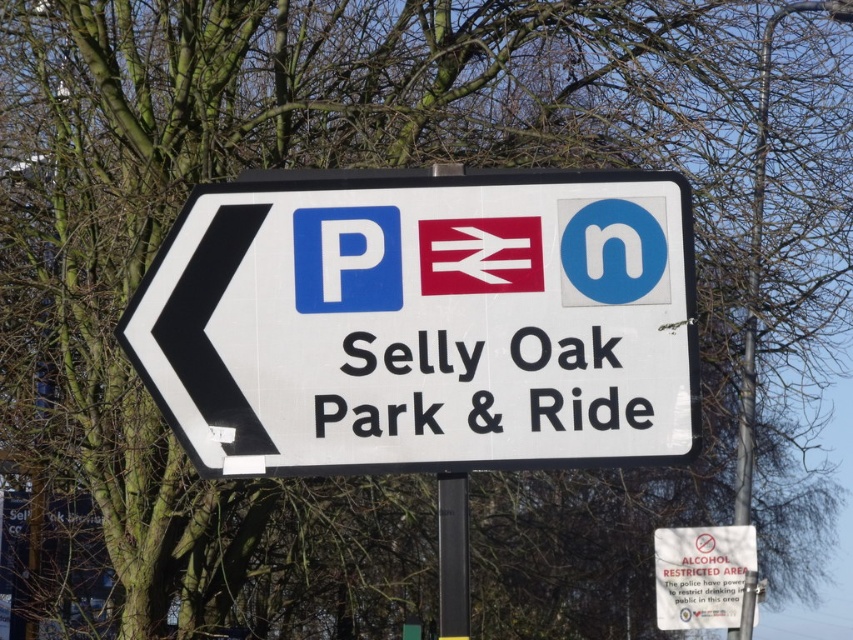
Who is shorter, white plastic sign at center or white paper sign at center?

With less height is white paper sign at center.

Locate an element on the screen. white plastic sign at center is located at coordinates (422, 321).

This screenshot has height=640, width=853. In order to click on white plastic sign at center in this screenshot , I will do `click(422, 321)`.